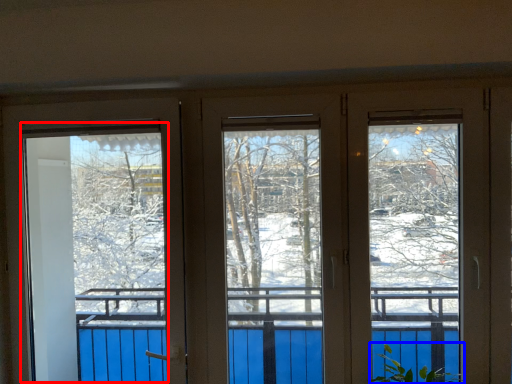
Question: Among these objects, which one is nearest to the camera, screen door (highlighted by a red box) or plant (highlighted by a blue box)?

Choices:
 (A) screen door
 (B) plant

Answer: (B)